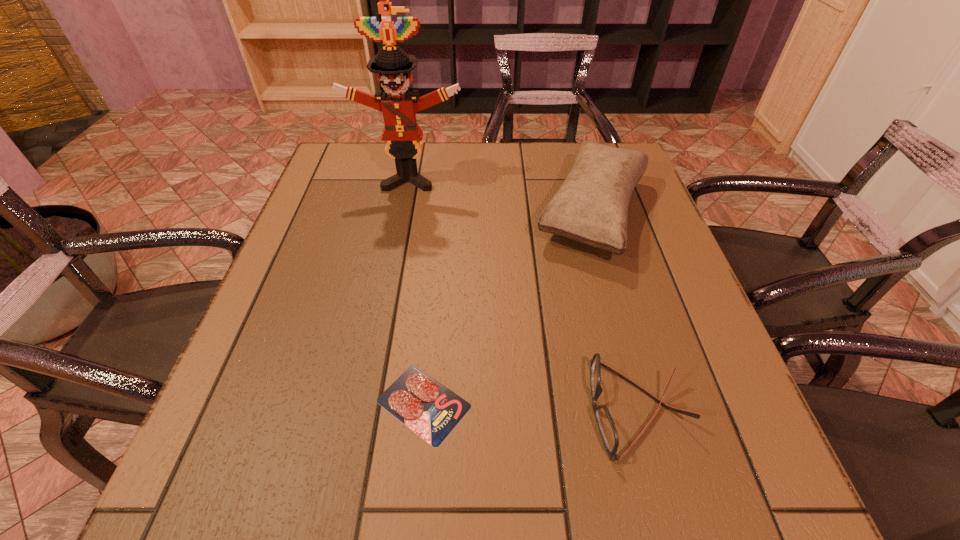
Image resolution: width=960 pixels, height=540 pixels. In the image, there is a desktop. Identify the location of vacant space at the near edge. click(x=561, y=493).

At what (x,y) coordinates should I click in order to perform the action: click on vacant area at the left edge of the desktop. Please return your answer as a coordinate pair (x, y). Image resolution: width=960 pixels, height=540 pixels. Looking at the image, I should click on (211, 423).

This screenshot has width=960, height=540. In order to click on vacant space at the right edge of the desktop in this screenshot , I will do `click(654, 348)`.

Identify the location of free space at the near left corner. This screenshot has width=960, height=540. (201, 507).

Where is `blank space at the near right corner of the desktop`? This screenshot has height=540, width=960. blank space at the near right corner of the desktop is located at coordinates (729, 464).

You are a GUI agent. You are given a task and a screenshot of the screen. Output one action in this format:
    pyautogui.click(x=<x>, y=<y>)
    Task: Click on the free space between the cushion and the second shortest object
    This screenshot has width=960, height=540.
    Given the screenshot: What is the action you would take?
    pyautogui.click(x=615, y=310)

Find the location of a particular element. The image size is (960, 540). blank region between the third shortest object and the shortest object is located at coordinates (509, 308).

Where is `empty location between the cushion and the second shortest object`? This screenshot has height=540, width=960. empty location between the cushion and the second shortest object is located at coordinates (615, 310).

Locate an element on the screen. empty location between the cushion and the spectacles is located at coordinates (615, 310).

At what (x,y) coordinates should I click in order to perform the action: click on vacant area between the salami and the spectacles. Please return your answer as a coordinate pair (x, y). The image size is (960, 540). Looking at the image, I should click on (531, 406).